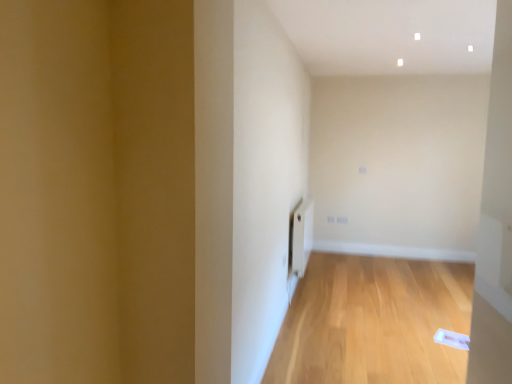
Find the location of a particular element. The height and width of the screenshot is (384, 512). free location above light wood floor at center (from a real-world perspective) is located at coordinates (392, 314).